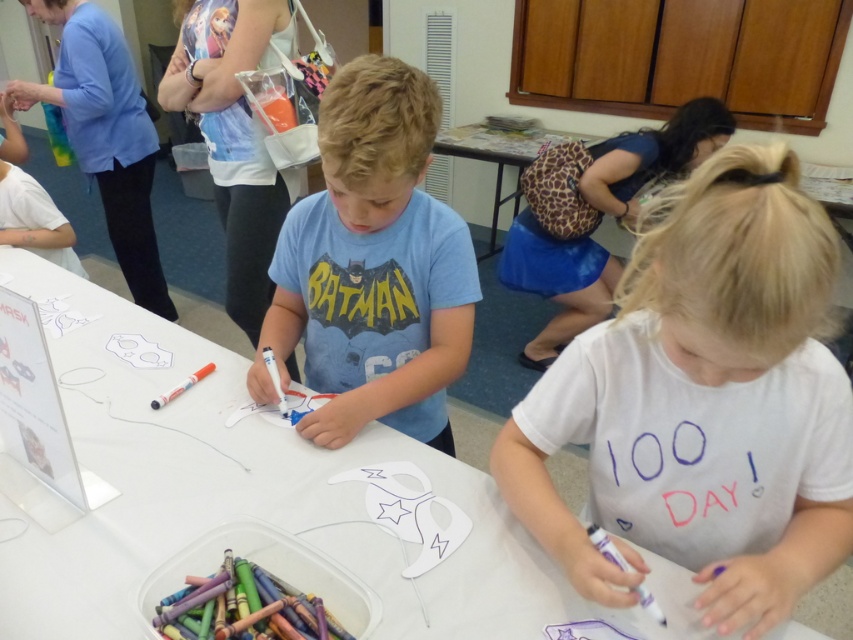
Is point (577, 246) less distant than point (167, 400)?

No, (577, 246) is further to viewer.

Who is positioned more to the right, white fabric skirt at upper center or orange matte marker at lower left?

white fabric skirt at upper center is more to the right.

Is point (596, 282) in front of point (163, 396)?

No, it is not.

Identify the location of white fabric skirt at upper center. (556, 282).

Does white cotton shirt at lower right have a greater height compared to white fabric skirt at upper center?

No, white cotton shirt at lower right is not taller than white fabric skirt at upper center.

This screenshot has height=640, width=853. What do you see at coordinates (704, 401) in the screenshot? I see `white cotton shirt at lower right` at bounding box center [704, 401].

I want to click on white cotton shirt at lower right, so click(x=704, y=401).

Who is more distant from viewer, (654, 132) or (498, 152)?

The point (498, 152) is behind.

Is point (555, 284) closer to viewer compared to point (532, 154)?

Yes, point (555, 284) is in front of point (532, 154).

Locate an element on the screen. The image size is (853, 640). white fabric skirt at upper center is located at coordinates (556, 282).